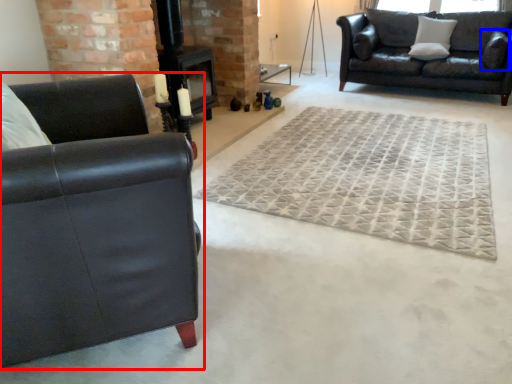
Question: Which of the following is the farthest to the observer, studio couch (highlighted by a red box) or pillow (highlighted by a blue box)?

Choices:
 (A) studio couch
 (B) pillow

Answer: (B)